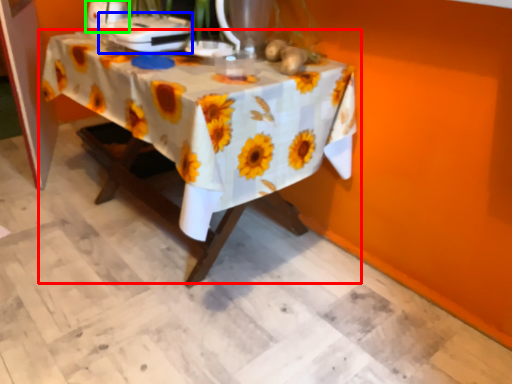
Question: Based on their relative distances, which object is nearer to table (highlighted by a red box)? Choose from appliance (highlighted by a blue box) and appliance (highlighted by a green box).

Choices:
 (A) appliance
 (B) appliance

Answer: (A)